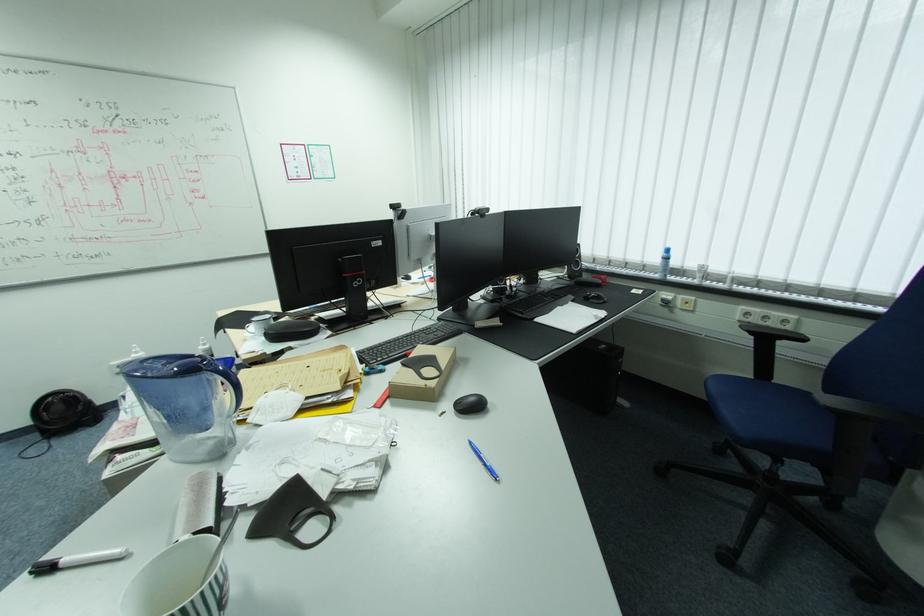
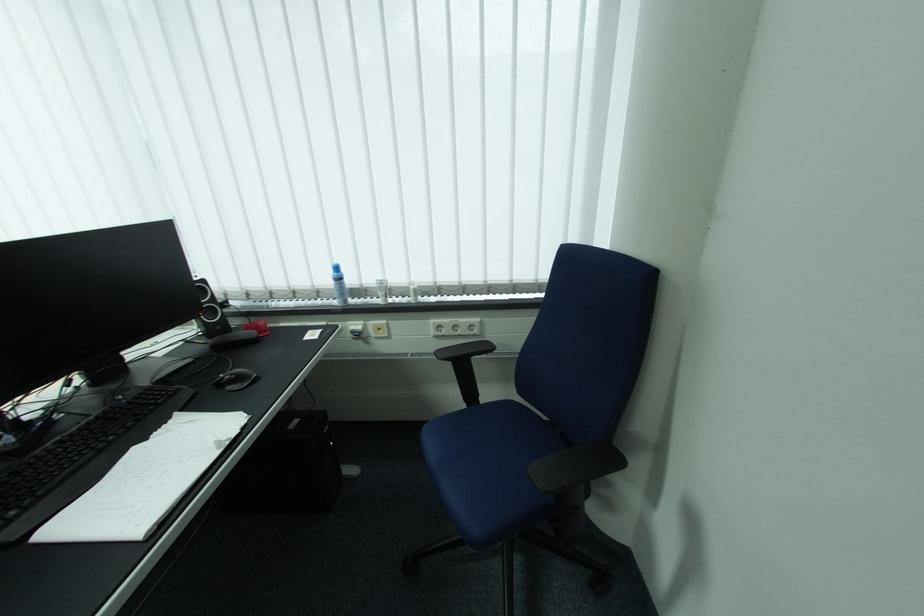
Question: How did the camera likely rotate?

Choices:
 (A) Left
 (B) Right
 (C) Up
 (D) Down

Answer: (B)